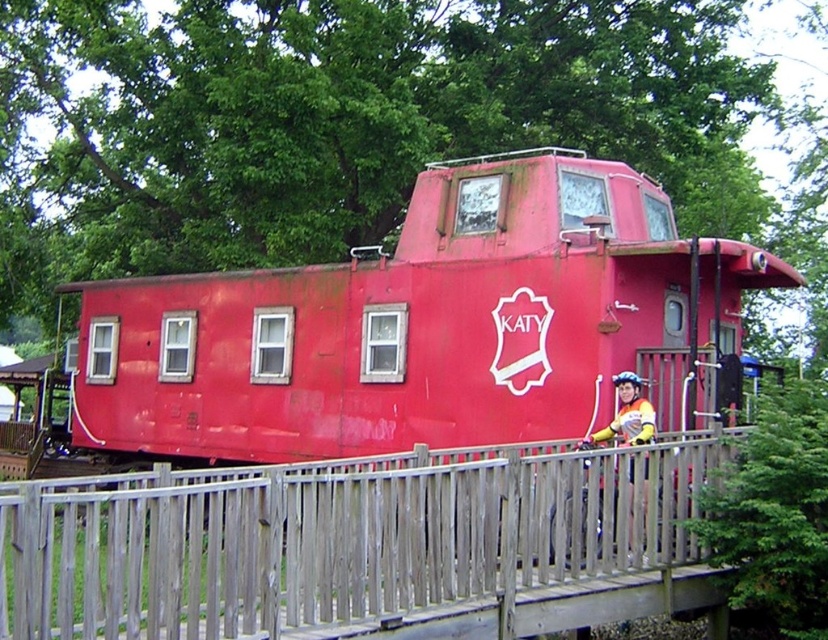
Question: Which object appears closest to the camera in this image?

Choices:
 (A) wooden fence at center
 (B) rusty red caboose at center

Answer: (A)

Question: Does rusty red caboose at center appear on the left side of wooden fence at center?

Choices:
 (A) yes
 (B) no

Answer: (A)

Question: Can you confirm if rusty red caboose at center is smaller than wooden fence at center?

Choices:
 (A) no
 (B) yes

Answer: (A)

Question: Can you confirm if rusty red caboose at center is wider than wooden fence at center?

Choices:
 (A) no
 (B) yes

Answer: (B)

Question: Which object is farther from the camera taking this photo?

Choices:
 (A) rusty red caboose at center
 (B) wooden fence at center

Answer: (A)